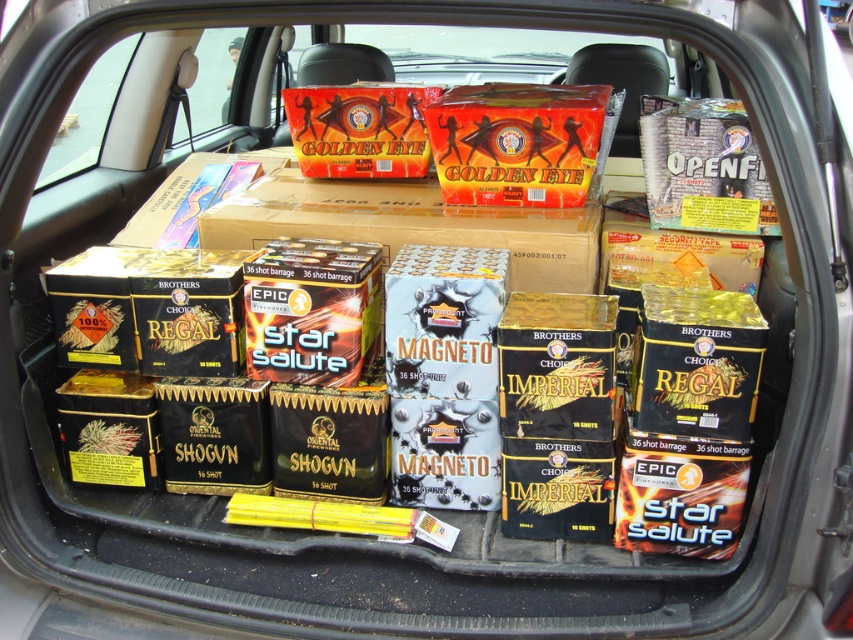
You are a delivery person who needs to place a new box at point [410,225]. However, there is already an orange cardboard box at center there. Can you place your new box there?

There is already an orange cardboard box at center at point [410,225], so you cannot place your new box there.

You are organizing the trunk of a car and need to place the orange cardboard box at center and the orange matte box at center. Since both are orange, how can you distinguish them based on their material?

The orange cardboard box at center is larger in size than the orange matte box at center, so you can tell them apart by their size difference.